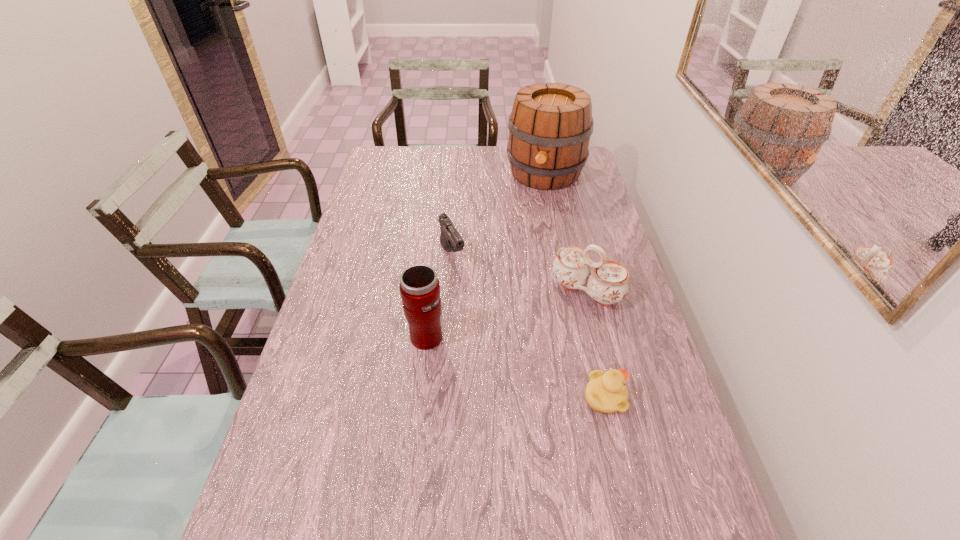
Locate an element on the screen. The width and height of the screenshot is (960, 540). the second tallest object is located at coordinates (419, 286).

This screenshot has height=540, width=960. I want to click on thermos bottle, so click(x=419, y=286).

Identify the location of duckling. The image size is (960, 540). (606, 392).

Where is `the shortest object`? the shortest object is located at coordinates (606, 392).

Locate an element on the screen. The width and height of the screenshot is (960, 540). the second shortest object is located at coordinates (450, 239).

Locate an element on the screen. The image size is (960, 540). the third tallest object is located at coordinates 607,284.

The height and width of the screenshot is (540, 960). Find the location of `cider`. cider is located at coordinates (550, 125).

Image resolution: width=960 pixels, height=540 pixels. Identify the location of the tallest object. (550, 125).

Locate an element on the screen. Image resolution: width=960 pixels, height=540 pixels. free spot located on the side with the handle of the second tallest object is located at coordinates (381, 336).

What are the coordinates of `free space located 0.150m on the side with the handle of the second tallest object` in the screenshot? It's located at (348, 336).